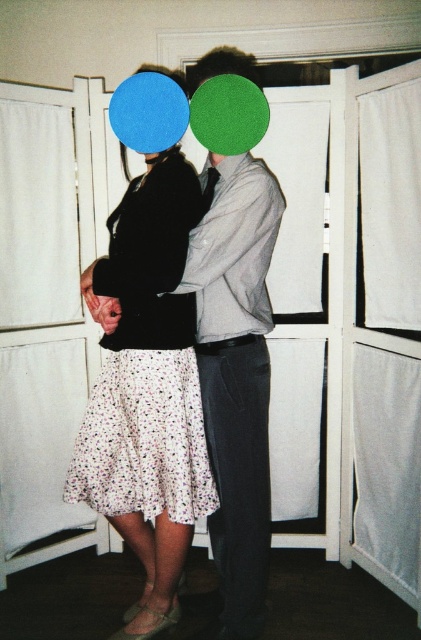
Does floral cotton dress at center have a greater height compared to white floral skirt at lower left?

Incorrect, floral cotton dress at center's height is not larger of white floral skirt at lower left's.

Does point (125, 448) lie behind point (282, 211)?

Yes, it is behind point (282, 211).

I want to click on floral cotton dress at center, so click(148, 362).

Can you confirm if white floral skirt at lower left is positioned to the left of matte green hair at center?

Yes, white floral skirt at lower left is to the left of matte green hair at center.

Who is higher up, white floral skirt at lower left or matte green hair at center?

Positioned higher is matte green hair at center.

Does point (178, 204) lie behind point (221, 51)?

No.

Where is `white floral skirt at lower left`? Image resolution: width=421 pixels, height=640 pixels. white floral skirt at lower left is located at coordinates (226, 61).

Does floral cotton dress at center have a greater height compared to matte green hair at center?

Indeed, floral cotton dress at center has a greater height compared to matte green hair at center.

Is floral cotton dress at center below matte green hair at center?

Correct, floral cotton dress at center is located below matte green hair at center.

Between point (114, 266) and point (188, 74), which one is positioned in front?

Point (114, 266)

Image resolution: width=421 pixels, height=640 pixels. I want to click on floral cotton dress at center, so click(148, 362).